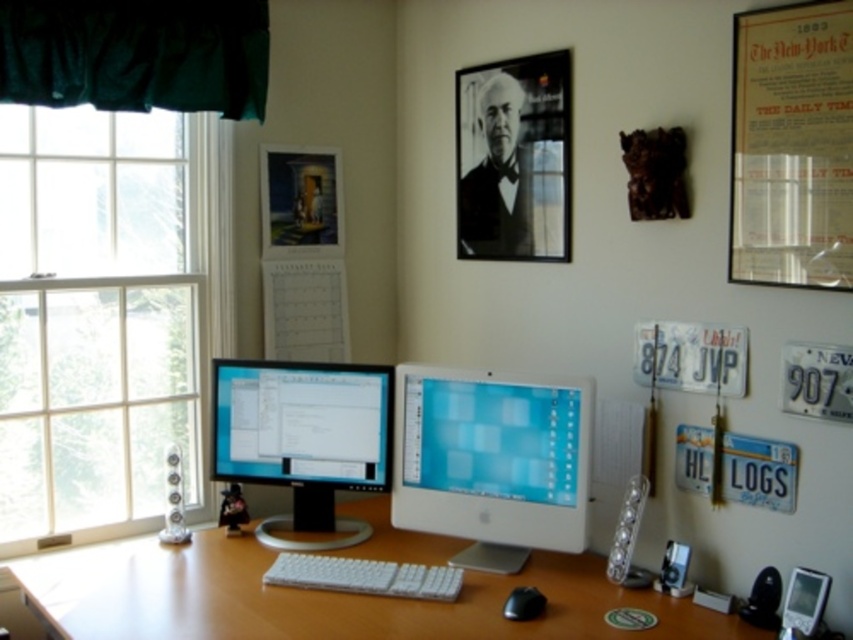
You are organizing a wall display in the home office. You have a matte paper poster at upper right and a white paper calendar at center. Which object is narrower?

The matte paper poster at upper right has a lesser width compared to the white paper calendar at center, so the matte paper poster at upper right is narrower.

What is located at the point with coordinates (514, 157) in the image?

Result: The point at coordinates (514, 157) indicates the location of the black matte portrait at upper center.